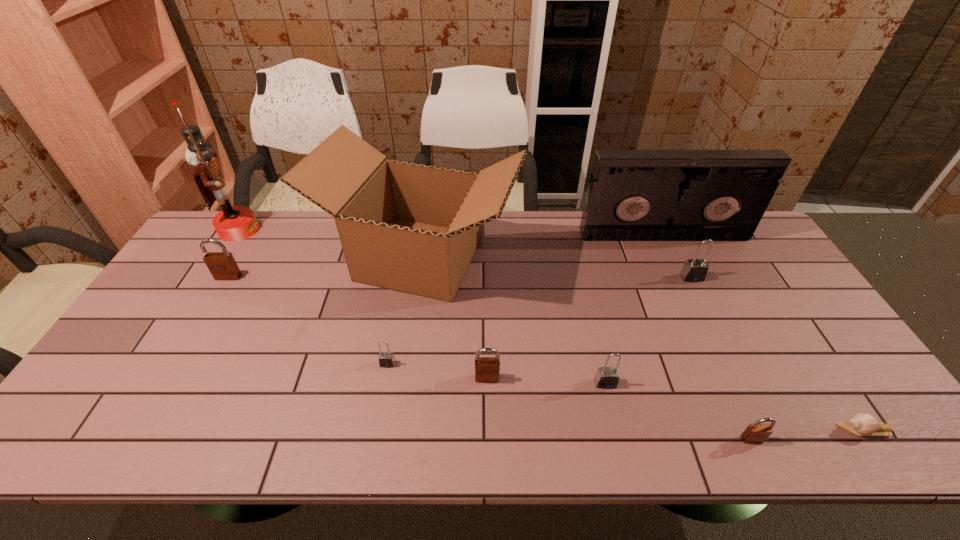
Find the location of a particular element. the closest brown padlock to the nearest gray padlock is located at coordinates point(487,369).